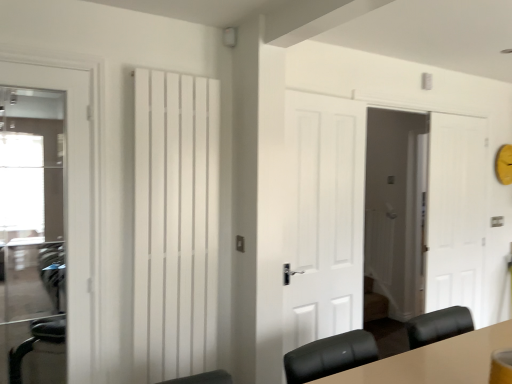
Question: Considering the relative positions of white matte radiator at center and white matte door at center, which ranks as the second door in right-to-left order, in the image provided, is white matte radiator at center behind white matte door at center, which ranks as the second door in right-to-left order,?

Choices:
 (A) yes
 (B) no

Answer: (B)

Question: From the image's perspective, does white matte radiator at center appear lower than white matte door at center, which is counted as the 3th door, starting from the front?

Choices:
 (A) no
 (B) yes

Answer: (A)

Question: Is white matte radiator at center smaller than white matte door at center, which ranks as the second door in right-to-left order?

Choices:
 (A) no
 (B) yes

Answer: (B)

Question: Are white matte radiator at center and white matte door at center, which is counted as the 2th door, starting from the back, making contact?

Choices:
 (A) no
 (B) yes

Answer: (A)

Question: Is the position of white matte radiator at center less distant than that of white matte door at center, which is counted as the 3th door, starting from the front?

Choices:
 (A) no
 (B) yes

Answer: (B)

Question: Relative to white matte door at right, the 1th door viewed from the right, is white matte radiator at center in front or behind?

Choices:
 (A) front
 (B) behind

Answer: (A)

Question: From a real-world perspective, is white matte radiator at center above or below white matte door at right, the 1th door viewed from the right?

Choices:
 (A) below
 (B) above

Answer: (B)

Question: Is point (160, 213) positioned closer to the camera than point (467, 264)?

Choices:
 (A) closer
 (B) farther

Answer: (A)

Question: Is white matte radiator at center taller or shorter than white matte door at right, placed as the 4th door when sorted from front to back?

Choices:
 (A) tall
 (B) short

Answer: (B)

Question: From the image's perspective, is white matte radiator at center located above or below white matte door at center, positioned as the 3th door in right-to-left order?

Choices:
 (A) above
 (B) below

Answer: (A)

Question: Considering their positions, is white matte radiator at center located in front of or behind white matte door at center, arranged as the second door when viewed from the left?

Choices:
 (A) front
 (B) behind

Answer: (A)

Question: Is white matte radiator at center situated inside white matte door at center, which ranks as the second door in front-to-back order, or outside?

Choices:
 (A) inside
 (B) outside

Answer: (B)

Question: In terms of width, does white matte radiator at center look wider or thinner when compared to white matte door at center, positioned as the 3th door in right-to-left order?

Choices:
 (A) thin
 (B) wide

Answer: (B)

Question: Considering the positions of white matte door at right, marked as the fourth door in a left-to-right arrangement, and white matte door at center, arranged as the second door when viewed from the left, in the image, is white matte door at right, marked as the fourth door in a left-to-right arrangement, taller or shorter than white matte door at center, arranged as the second door when viewed from the left,?

Choices:
 (A) short
 (B) tall

Answer: (B)

Question: Based on their positions, is white matte door at right, marked as the fourth door in a left-to-right arrangement, located to the left or right of white matte door at center, which ranks as the second door in front-to-back order?

Choices:
 (A) left
 (B) right

Answer: (B)